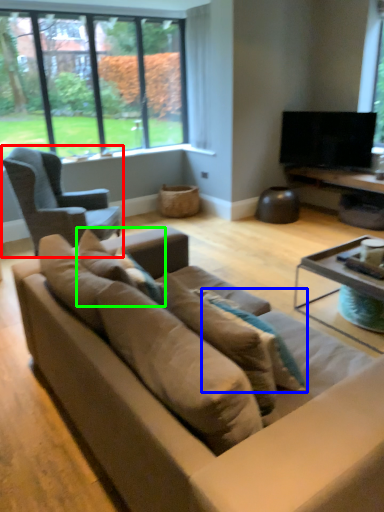
Question: Considering the real-world distances, which object is closest to chair (highlighted by a red box)? pillow (highlighted by a blue box) or pillow (highlighted by a green box).

Choices:
 (A) pillow
 (B) pillow

Answer: (B)